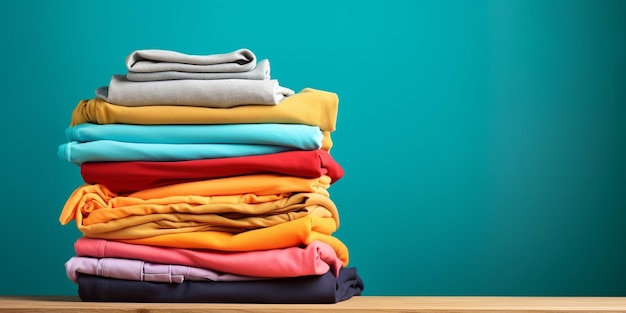
I want to click on yellow folded clothing items, so click(x=310, y=115), click(x=279, y=179), click(x=242, y=209), click(x=258, y=240).